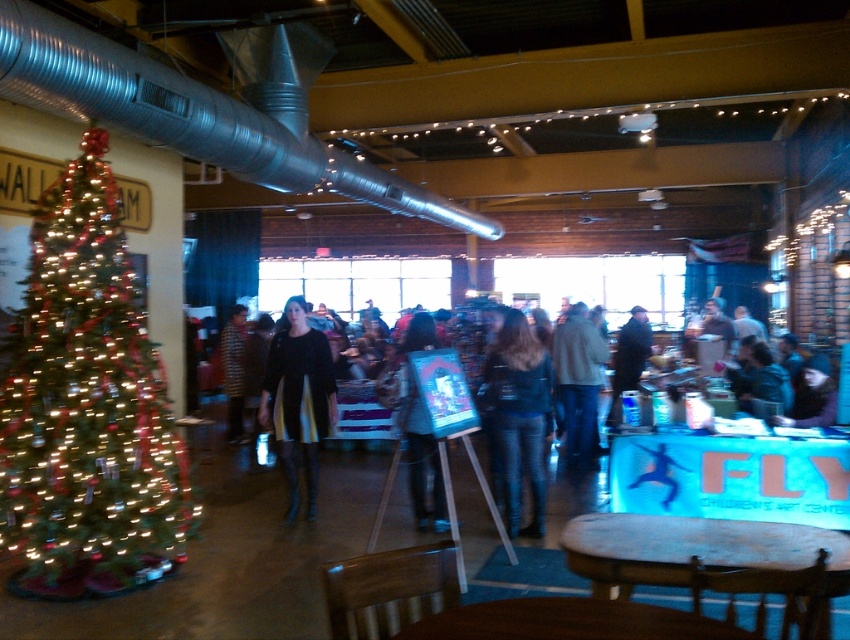
In the scene shown: You are at the entrance of the event space and want to find the person wearing the matte black jacket at center. According to the spatial coordinates provided, where should you look relative to the Christmas tree?

The matte black jacket at center is located at point 0.659 on the x axis and 0.489 on the y axis. Since the Christmas tree is on the left side of the image, the coordinates suggest the jacket is positioned to the right of the tree and closer to the center of the space.

You are at a winter market and want to reach the wooden table at center to buy a souvenir. However, there is a shiny gold christmas tree at left blocking your path. Can you walk around the tree to get to the table?

The wooden table at center is behind the shiny gold christmas tree at left, so you can walk around the tree to reach the table.

You are organizing a photo shoot and need to place a large camera tripod between the matte black jacket at center and the striped fabric coat at center. The tripod requires 1.2 meters of space. Can the space between them accommodate the tripod?

The matte black jacket at center is larger than the striped fabric coat at center, but the exact distance between them isn